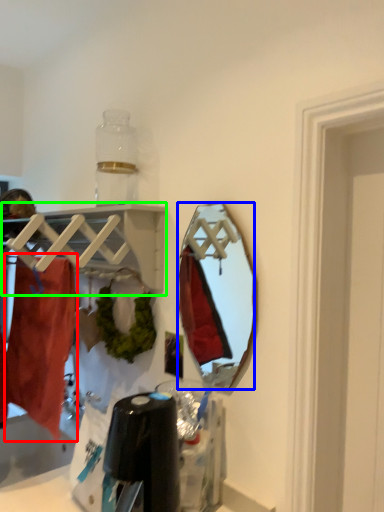
Question: Estimate the real-world distances between objects in this image. Which object is farther from clothing (highlighted by a red box), mirror (highlighted by a blue box) or shelf (highlighted by a green box)?

Choices:
 (A) mirror
 (B) shelf

Answer: (A)